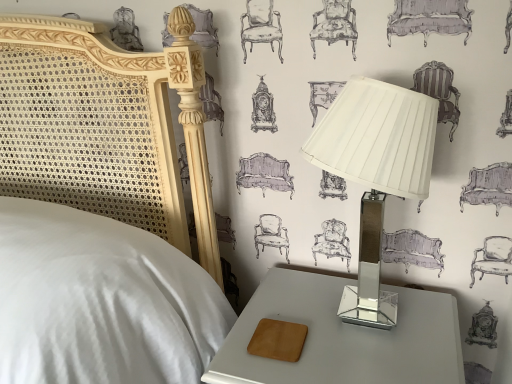
Where is `vacant area situated below metallic silver lamp at right (from a real-world perspective)`? vacant area situated below metallic silver lamp at right (from a real-world perspective) is located at coordinates [x=359, y=315].